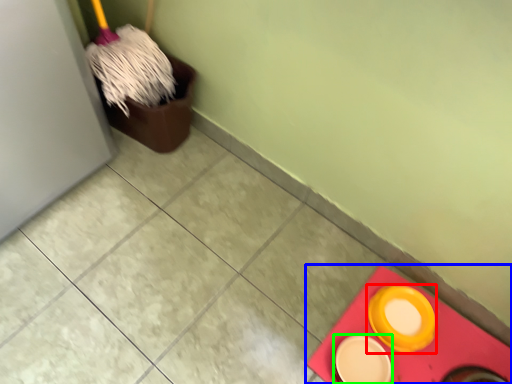
Question: Based on their relative distances, which object is nearer to tableware (highlighted by a red box)? Choose from tile (highlighted by a blue box) and tableware (highlighted by a green box).

Choices:
 (A) tile
 (B) tableware

Answer: (A)